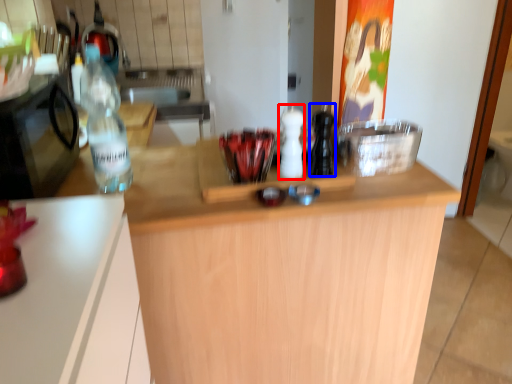
Question: Which point is further to the camera, bottle (highlighted by a red box) or bottle (highlighted by a blue box)?

Choices:
 (A) bottle
 (B) bottle

Answer: (A)